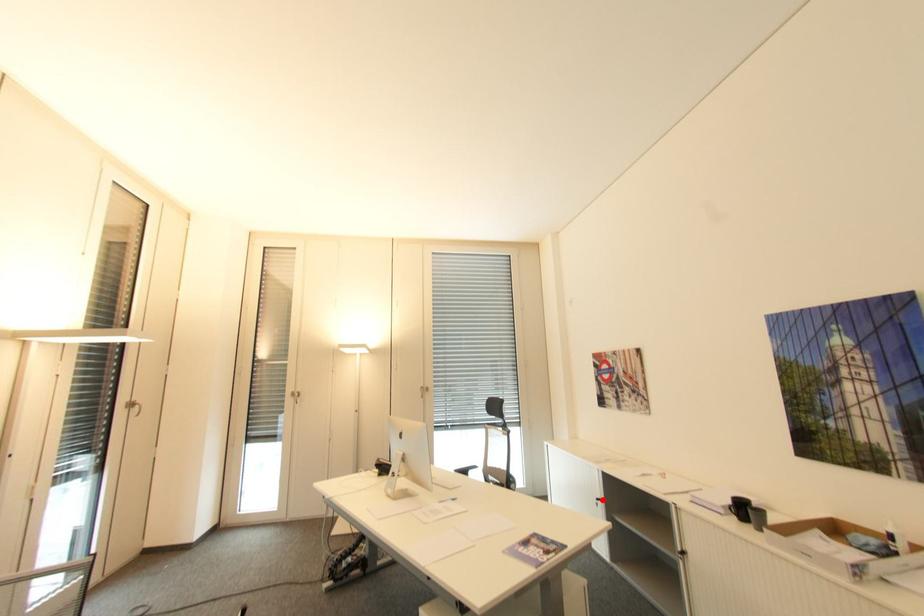
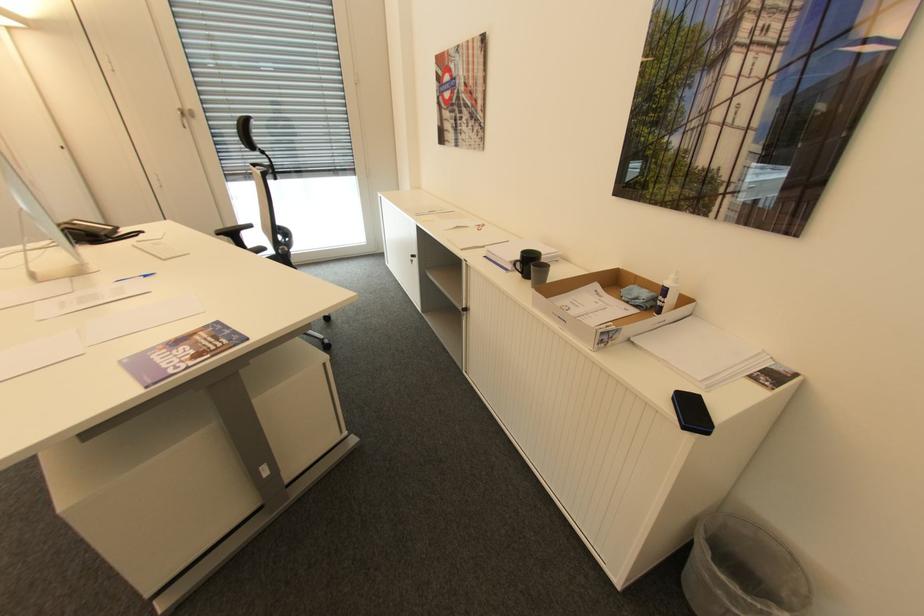
The point at the highlighted location is marked in the first image. Where is the corresponding point in the second image?

(418, 256)